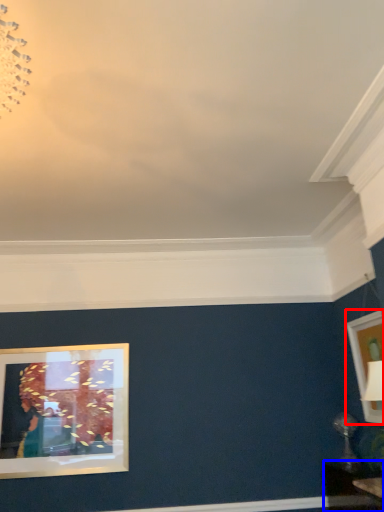
Question: Among these objects, which one is farthest to the camera, picture frame (highlighted by a red box) or table (highlighted by a blue box)?

Choices:
 (A) picture frame
 (B) table

Answer: (A)